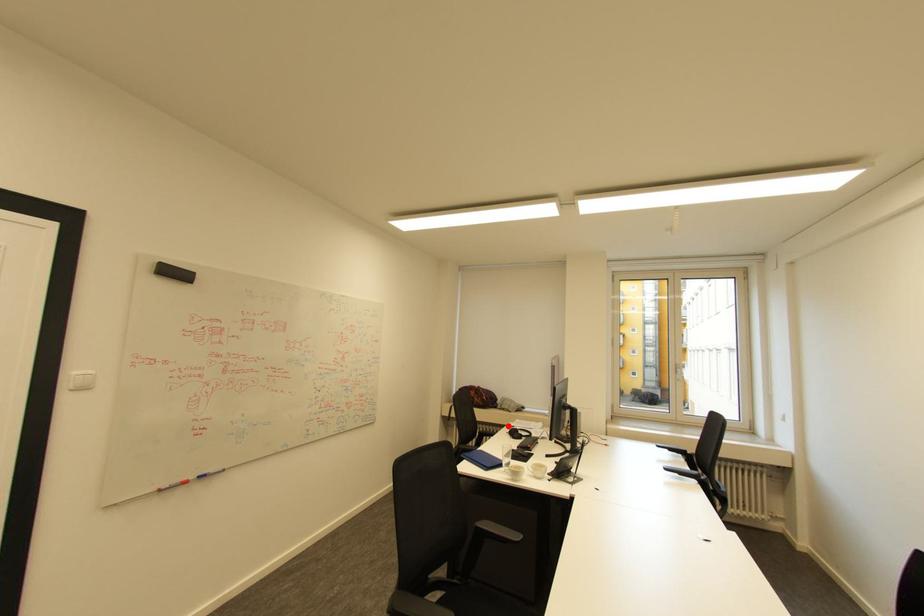
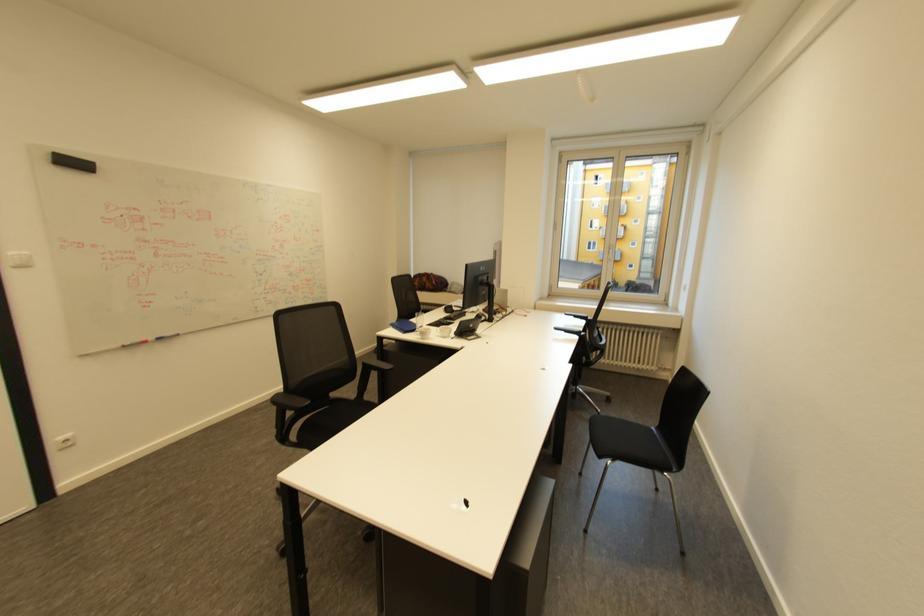
Locate, in the second image, the point that corresponds to the highlighted location in the first image.

(448, 305)